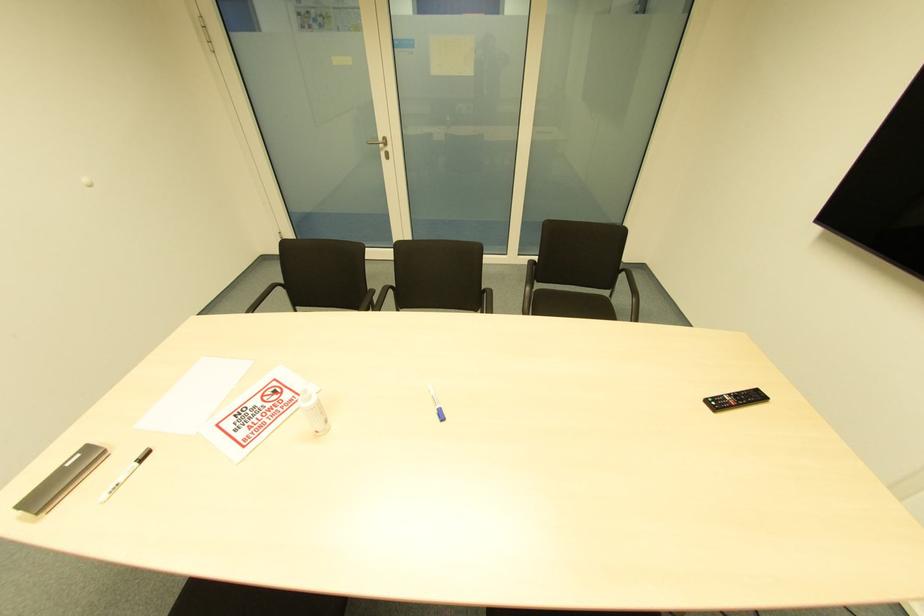
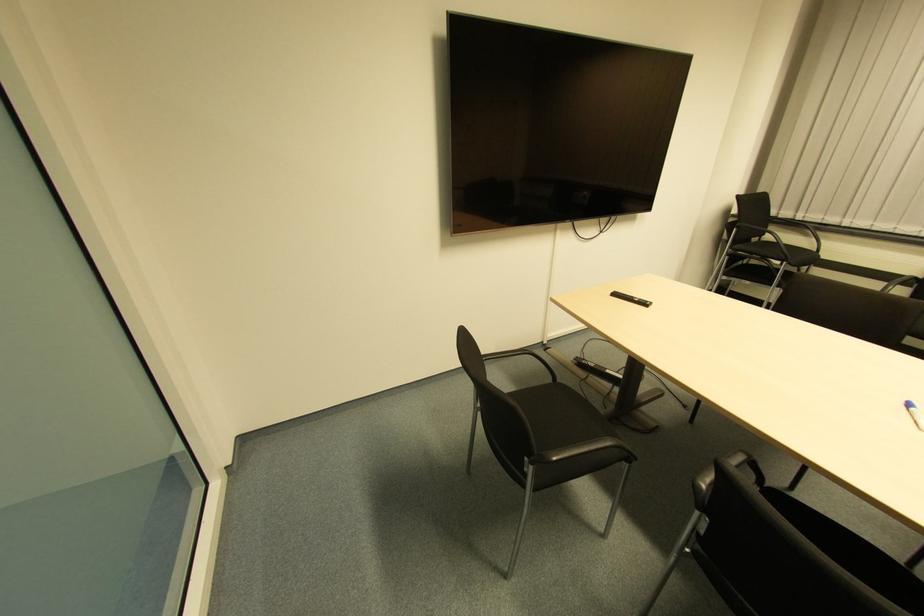
The point at (441, 419) is marked in the first image. Where is the corresponding point in the second image?

(907, 408)